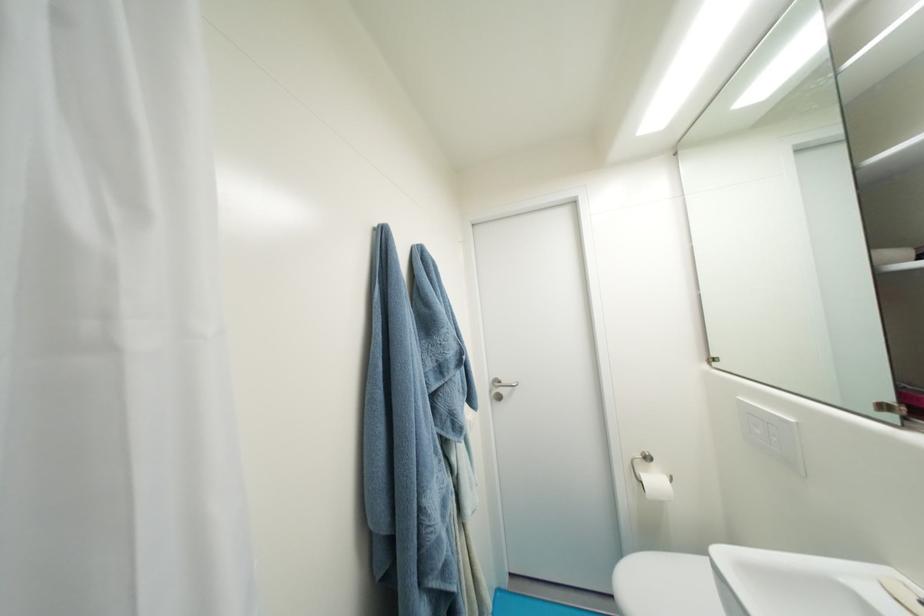
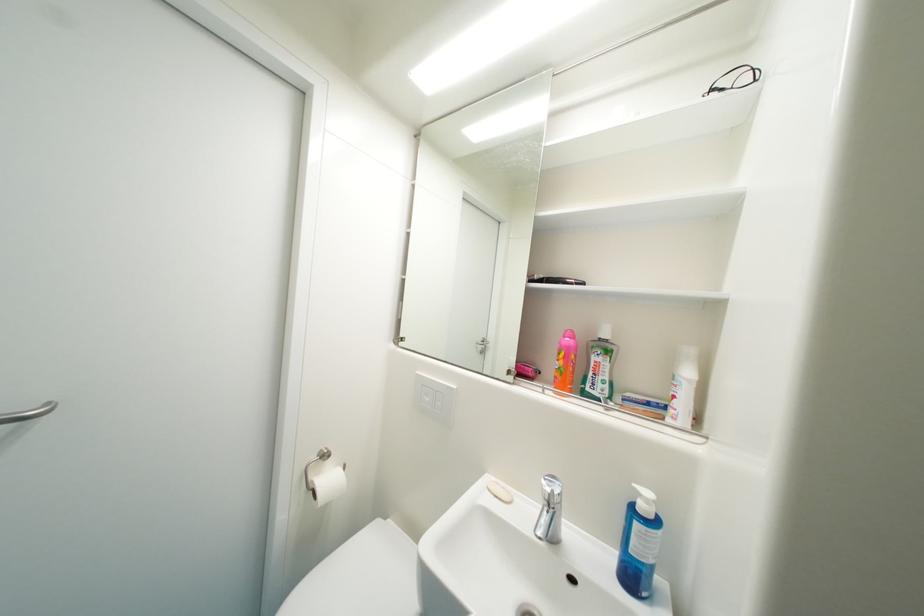
In the second image, find the point that corresponds to pixel 662 482 in the first image.

(337, 482)